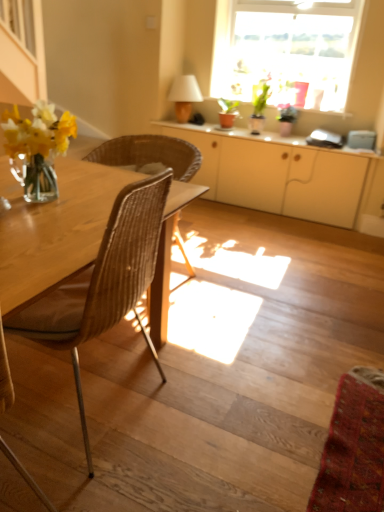
Question: From the image's perspective, is wooden stairs at lower left above or below matte white cabinet at center?

Choices:
 (A) above
 (B) below

Answer: (B)

Question: Considering their positions, is wooden stairs at lower left located in front of or behind matte white cabinet at center?

Choices:
 (A) behind
 (B) front

Answer: (B)

Question: Which of these objects is positioned farthest from the matte white cabinet at center?

Choices:
 (A) green glossy plant at upper center
 (B) wooden stairs at lower left
 (C) matte beige lampshade at upper center
 (D) brown woven chair at left
 (E) white glossy cabinet at center

Answer: (D)

Question: Which of these objects is positioned farthest from the matte beige lampshade at upper center?

Choices:
 (A) wooden stairs at lower left
 (B) brown woven chair at left
 (C) matte white cabinet at center
 (D) translucent glass window at upper center
 (E) woven wood chair at left

Answer: (B)